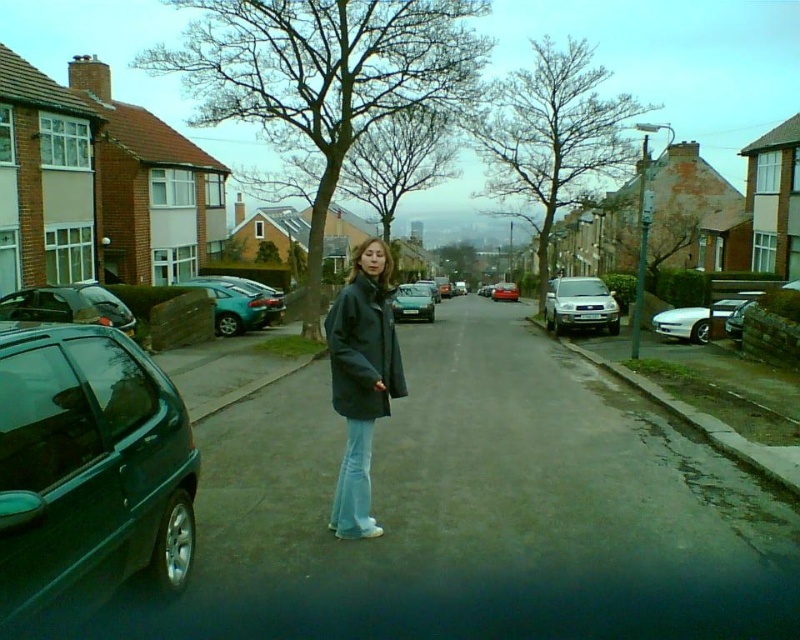
Is point (725, 321) closer to camera compared to point (430, 296)?

Yes.

Can you confirm if white glossy sedan at right is positioned to the left of metallic blue hatchback at center?

Incorrect, white glossy sedan at right is not on the left side of metallic blue hatchback at center.

Identify the location of white glossy sedan at right. (698, 317).

Find the location of a particular element. The width and height of the screenshot is (800, 640). white glossy sedan at right is located at coordinates (698, 317).

Is point (230, 316) farther from camera compared to point (733, 305)?

Yes, it is.

Between point (256, 298) and point (737, 300), which one is positioned in front?

Point (737, 300)

Find the location of a particular element. teal glossy hatchback at center-left is located at coordinates (232, 307).

Can you confirm if satin silver suv at center-right is wider than shiny metallic sedan at center?

In fact, satin silver suv at center-right might be narrower than shiny metallic sedan at center.

Is satin silver suv at center-right in front of shiny metallic sedan at center?

Yes, satin silver suv at center-right is closer to the viewer.

Is point (554, 280) farther from viewer compared to point (516, 285)?

No, it is not.

At what (x,y) coordinates should I click in order to perform the action: click on satin silver suv at center-right. Please return your answer as a coordinate pair (x, y). The height and width of the screenshot is (640, 800). Looking at the image, I should click on (580, 305).